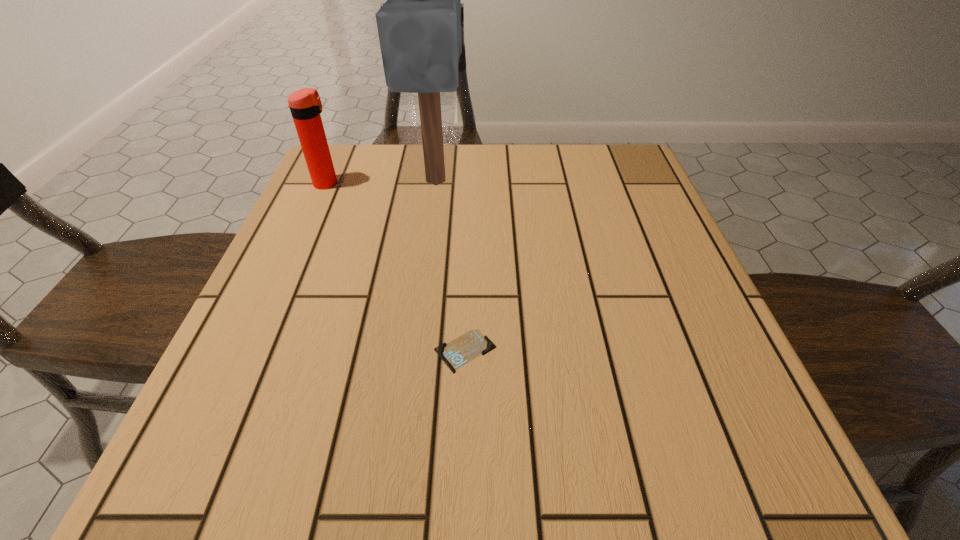
Locate an element on the screen. This screenshot has height=540, width=960. the tallest object is located at coordinates (419, 26).

This screenshot has width=960, height=540. Identify the location of the leftmost object. (305, 105).

At what (x,y) coordinates should I click in order to perform the action: click on the second shortest object. Please return your answer as a coordinate pair (x, y). The height and width of the screenshot is (540, 960). Looking at the image, I should click on (305, 105).

This screenshot has height=540, width=960. I want to click on the shortest object, so click(461, 350).

The height and width of the screenshot is (540, 960). Identify the location of identity card. (461, 350).

Identify the location of free space located on the left of the mallet. pyautogui.click(x=378, y=181).

Where is `vacant space positioned on the right of the second shortest object`? vacant space positioned on the right of the second shortest object is located at coordinates (363, 183).

Find the location of `free region located on the right of the shortest object`. free region located on the right of the shortest object is located at coordinates (554, 350).

This screenshot has width=960, height=540. What are the coordinates of `mallet that is at the far edge` in the screenshot? It's located at (419, 26).

Identify the location of thermos bottle situated at the far edge. This screenshot has height=540, width=960. [x=305, y=105].